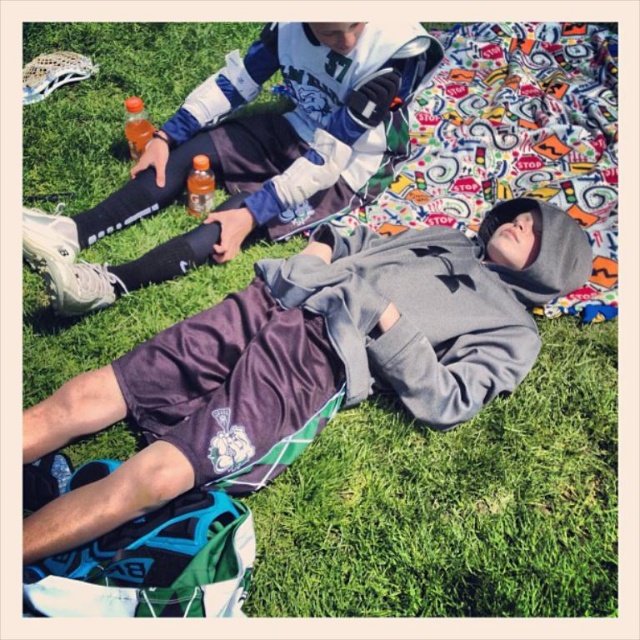
Question: Does gray fleece hoodie at center have a lesser width compared to translucent orange bottle at upper left?

Choices:
 (A) no
 (B) yes

Answer: (A)

Question: Is gray hoodie at center wider than translucent plastic bottle at center?

Choices:
 (A) yes
 (B) no

Answer: (A)

Question: Which object appears farthest from the camera in this image?

Choices:
 (A) gray hoodie at center
 (B) translucent orange bottle at upper left

Answer: (B)

Question: Is gray fleece hoodie at center to the right of translucent orange bottle at upper left from the viewer's perspective?

Choices:
 (A) yes
 (B) no

Answer: (A)

Question: Among these points, which one is nearest to the camera?

Choices:
 (A) (205, 205)
 (B) (492, 257)
 (C) (140, 132)
 (D) (244, 173)

Answer: (B)

Question: Considering the real-world distances, which object is closest to the translucent orange bottle at upper left?

Choices:
 (A) gray fleece hoodie at center
 (B) gray hoodie at center
 (C) translucent plastic bottle at center

Answer: (C)